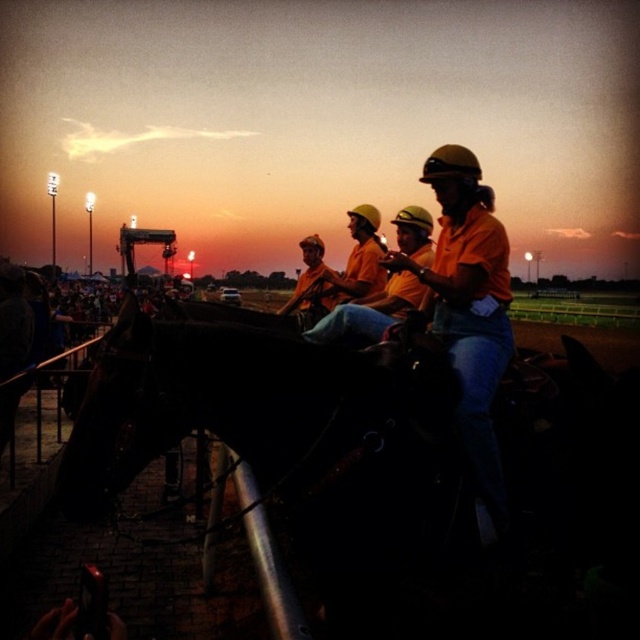
Question: Is black glossy horse at center behind orange hard hat at center?

Choices:
 (A) yes
 (B) no

Answer: (B)

Question: Is black glossy horse at center above orange hard hat at center?

Choices:
 (A) no
 (B) yes

Answer: (A)

Question: Is black glossy horse at center wider than orange cotton shirt at center?

Choices:
 (A) yes
 (B) no

Answer: (A)

Question: Which object is positioned farthest from the black glossy horse at center?

Choices:
 (A) orange hard hat at center
 (B) orange cotton shirt at center

Answer: (A)

Question: Estimate the real-world distances between objects in this image. Which object is farther from the orange hard hat at center?

Choices:
 (A) black glossy horse at center
 (B) orange cotton shirt at center

Answer: (A)

Question: Which of the following is the closest to the observer?

Choices:
 (A) orange hard hat at center
 (B) orange cotton shirt at center

Answer: (B)